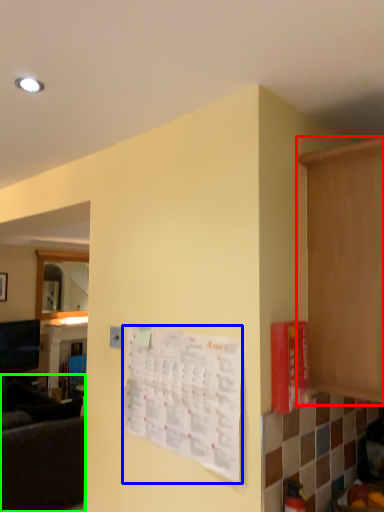
Question: Considering the real-world distances, which object is farthest from cabinetry (highlighted by a red box)? bulletin board (highlighted by a blue box) or couch (highlighted by a green box)?

Choices:
 (A) bulletin board
 (B) couch

Answer: (B)